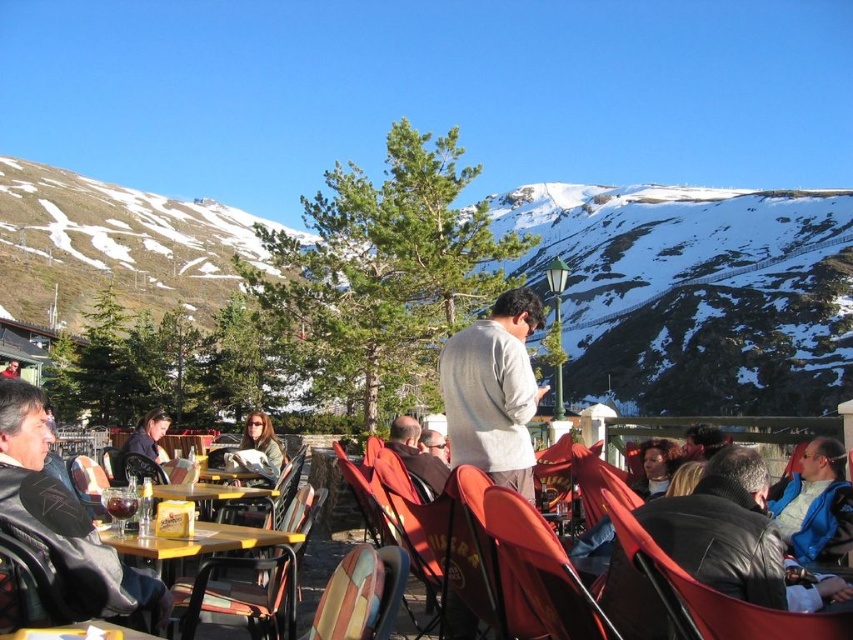
Question: Does gray cotton shirt at center lie in front of black leather chair at lower right?

Choices:
 (A) no
 (B) yes

Answer: (A)

Question: Does matte red chair at center appear over brown leather jacket at center?

Choices:
 (A) no
 (B) yes

Answer: (A)

Question: Estimate the real-world distances between objects in this image. Which object is closer to the matte red chair at center?

Choices:
 (A) leather jacket at lower left
 (B) snowy rock at upper center
 (C) yellow wood table at center

Answer: (C)

Question: Among these objects, which one is nearest to the camera?

Choices:
 (A) matte red chair at center
 (B) multicolored fabric chair at center

Answer: (B)

Question: Is black leather chair at lower right closer to the viewer compared to yellow wood table at center?

Choices:
 (A) no
 (B) yes

Answer: (B)

Question: Which object is the farthest from the yellow wood table at center?

Choices:
 (A) multicolored fabric chair at center
 (B) brown leather jacket at center
 (C) snowy rock at upper center

Answer: (C)